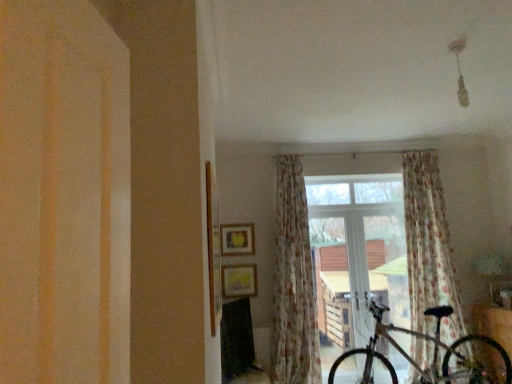
Question: From a real-world perspective, relative to floral fabric curtain at center, arranged as the second curtain when viewed from the left, is floral fabric curtain at center, marked as the 2th curtain in a right-to-left arrangement, vertically above or below?

Choices:
 (A) above
 (B) below

Answer: (A)

Question: Visually, is floral fabric curtain at center, acting as the 1th curtain starting from the left, positioned to the left or to the right of floral fabric curtain at center, arranged as the second curtain when viewed from the left?

Choices:
 (A) right
 (B) left

Answer: (B)

Question: Which of these objects is positioned farthest from the metallic silver bicycle at center?

Choices:
 (A) floral fabric curtain at center, the 1th curtain viewed from the right
 (B) transparent glass window at center
 (C) matte yellow picture frame at center, the 1th picture frame when ordered from top to bottom
 (D) matte yellow picture frame at center, the 2th picture frame in the top-to-bottom sequence
 (E) floral fabric curtain at center, acting as the 1th curtain starting from the left

Answer: (C)

Question: Which is nearer to the transparent glass window at center?

Choices:
 (A) metallic silver bicycle at center
 (B) floral fabric curtain at center, marked as the 2th curtain in a right-to-left arrangement
 (C) floral fabric curtain at center, the 1th curtain viewed from the right
 (D) matte yellow picture frame at center, the 2th picture frame in the top-to-bottom sequence
 (E) matte yellow picture frame at center, which appears as the 2th picture frame when ordered from the bottom

Answer: (C)